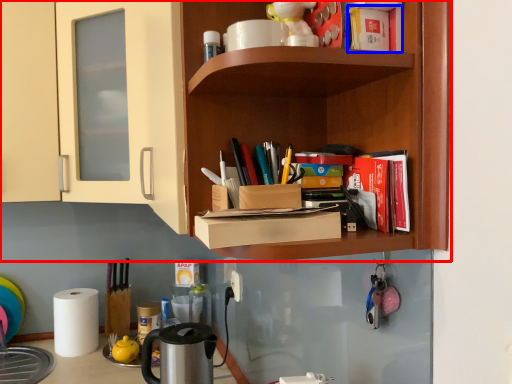
Question: Among these objects, which one is farthest to the camera, shelf (highlighted by a red box) or book (highlighted by a blue box)?

Choices:
 (A) shelf
 (B) book

Answer: (A)